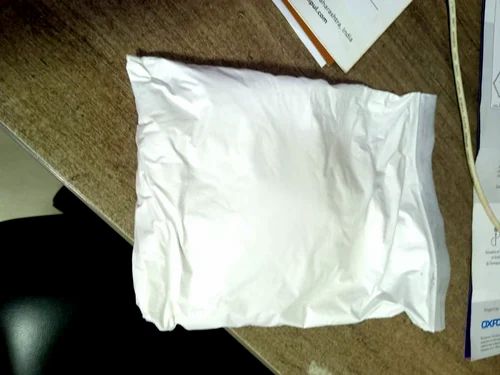
You are a GUI agent. You are given a task and a screenshot of the screen. Output one action in this format:
    pyautogui.click(x=<x>, y=<y>)
    Task: Click on the tan desk top
    
    Given the screenshot: What is the action you would take?
    pyautogui.click(x=91, y=111)